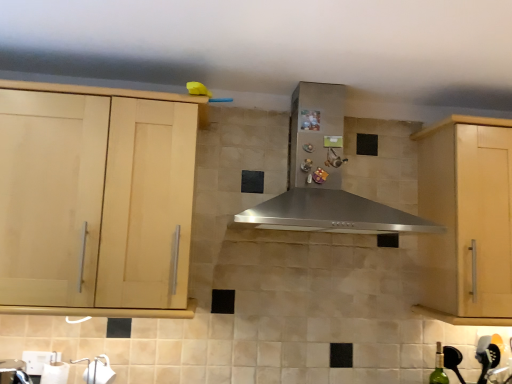
At what (x,y) coordinates should I click in order to perform the action: click on light wood cabinet at right, placed as the first cabinetry when sorted from right to left. Please return your answer as a coordinate pair (x, y). Looking at the image, I should click on (467, 218).

Measure the distance between point (137, 145) and camera.

They are 4.87 feet apart.

This screenshot has height=384, width=512. Describe the element at coordinates (325, 177) in the screenshot. I see `stainless steel range hood at center` at that location.

Identify the location of light wood cabinet at right, which is counted as the 2th cabinetry, starting from the left. (467, 218).

How much distance is there between stainless steel range hood at center and light wood cabinet at right, which is counted as the 2th cabinetry, starting from the left?

13.90 inches.

Consider the image. Choose the correct answer: Is stainless steel range hood at center inside light wood cabinet at right, placed as the first cabinetry when sorted from right to left, or outside it?

stainless steel range hood at center cannot be found inside light wood cabinet at right, placed as the first cabinetry when sorted from right to left.

The width and height of the screenshot is (512, 384). Identify the location of home appliance in front of the light wood cabinet at right, placed as the first cabinetry when sorted from right to left. (325, 177).

From their relative heights in the image, would you say stainless steel range hood at center is taller or shorter than light wood cabinet at right, which is counted as the 2th cabinetry, starting from the left?

stainless steel range hood at center is shorter than light wood cabinet at right, which is counted as the 2th cabinetry, starting from the left.

Is stainless steel range hood at center at the right side of light wood cabinet at left, which is counted as the 2th cabinetry, starting from the right?

Yes, stainless steel range hood at center is to the right of light wood cabinet at left, which is counted as the 2th cabinetry, starting from the right.

Is stainless steel range hood at center not inside light wood cabinet at left, arranged as the first cabinetry when viewed from the left?

Yes, stainless steel range hood at center is not within light wood cabinet at left, arranged as the first cabinetry when viewed from the left.

Could you tell me if stainless steel range hood at center is turned towards light wood cabinet at left, which is counted as the 2th cabinetry, starting from the right?

No, stainless steel range hood at center is not aimed at light wood cabinet at left, which is counted as the 2th cabinetry, starting from the right.

From the image's perspective, is stainless steel range hood at center above light wood cabinet at left, arranged as the first cabinetry when viewed from the left?

Correct, stainless steel range hood at center appears higher than light wood cabinet at left, arranged as the first cabinetry when viewed from the left, in the image.

From the picture: Can you confirm if green glass bottle at lower right is taller than stainless steel range hood at center?

No.

Is there a large distance between green glass bottle at lower right and stainless steel range hood at center?

No, green glass bottle at lower right is not far away from stainless steel range hood at center.

Where is `bottle below the stainless steel range hood at center (from a real-world perspective)`? Image resolution: width=512 pixels, height=384 pixels. bottle below the stainless steel range hood at center (from a real-world perspective) is located at coordinates (439, 368).

From the image's perspective, who appears lower, green glass bottle at lower right or stainless steel range hood at center?

From the image's view, green glass bottle at lower right is below.

From the image's perspective, is stainless steel range hood at center on top of green glass bottle at lower right?

Correct, stainless steel range hood at center appears higher than green glass bottle at lower right in the image.

Between stainless steel range hood at center and green glass bottle at lower right, which one has larger width?

With larger width is stainless steel range hood at center.

Which of these two, stainless steel range hood at center or green glass bottle at lower right, stands taller?

With more height is stainless steel range hood at center.

Which is in front, point (298, 168) or point (430, 379)?

The point (430, 379) is in front.

Is light wood cabinet at left, arranged as the first cabinetry when viewed from the left, positioned far away from green glass bottle at lower right?

Yes, light wood cabinet at left, arranged as the first cabinetry when viewed from the left, is far from green glass bottle at lower right.

Which of these two, light wood cabinet at left, arranged as the first cabinetry when viewed from the left, or green glass bottle at lower right, is wider?

Wider between the two is light wood cabinet at left, arranged as the first cabinetry when viewed from the left.

Considering the positions of objects light wood cabinet at left, arranged as the first cabinetry when viewed from the left, and green glass bottle at lower right in the image provided, who is more to the right, light wood cabinet at left, arranged as the first cabinetry when viewed from the left, or green glass bottle at lower right?

green glass bottle at lower right.

How far apart are light wood cabinet at left, arranged as the first cabinetry when viewed from the left, and green glass bottle at lower right?

They are 4.91 feet apart.

From the picture: How different are the orientations of light wood cabinet at right, which is counted as the 2th cabinetry, starting from the left, and stainless steel range hood at center in degrees?

The angular difference between light wood cabinet at right, which is counted as the 2th cabinetry, starting from the left, and stainless steel range hood at center is 0.108 degrees.

Considering the relative sizes of light wood cabinet at right, which is counted as the 2th cabinetry, starting from the left, and stainless steel range hood at center in the image provided, is light wood cabinet at right, which is counted as the 2th cabinetry, starting from the left, thinner than stainless steel range hood at center?

Yes, light wood cabinet at right, which is counted as the 2th cabinetry, starting from the left, is thinner than stainless steel range hood at center.

From a real-world perspective, is light wood cabinet at right, placed as the first cabinetry when sorted from right to left, beneath stainless steel range hood at center?

Yes, from a real-world perspective, light wood cabinet at right, placed as the first cabinetry when sorted from right to left, is under stainless steel range hood at center.

Considering the relative sizes of light wood cabinet at right, which is counted as the 2th cabinetry, starting from the left, and stainless steel range hood at center in the image provided, is light wood cabinet at right, which is counted as the 2th cabinetry, starting from the left, shorter than stainless steel range hood at center?

In fact, light wood cabinet at right, which is counted as the 2th cabinetry, starting from the left, may be taller than stainless steel range hood at center.

From a real-world perspective, is light wood cabinet at right, which is counted as the 2th cabinetry, starting from the left, positioned under light wood cabinet at left, arranged as the first cabinetry when viewed from the left, based on gravity?

Incorrect, from a real-world perspective, light wood cabinet at right, which is counted as the 2th cabinetry, starting from the left, is higher than light wood cabinet at left, arranged as the first cabinetry when viewed from the left.

Considering the sizes of objects light wood cabinet at right, placed as the first cabinetry when sorted from right to left, and light wood cabinet at left, which is counted as the 2th cabinetry, starting from the right, in the image provided, who is taller, light wood cabinet at right, placed as the first cabinetry when sorted from right to left, or light wood cabinet at left, which is counted as the 2th cabinetry, starting from the right,?

light wood cabinet at right, placed as the first cabinetry when sorted from right to left, is taller.

Are light wood cabinet at right, placed as the first cabinetry when sorted from right to left, and light wood cabinet at left, arranged as the first cabinetry when viewed from the left, beside each other?

There is a gap between light wood cabinet at right, placed as the first cabinetry when sorted from right to left, and light wood cabinet at left, arranged as the first cabinetry when viewed from the left.

Is light wood cabinet at right, placed as the first cabinetry when sorted from right to left, inside the boundaries of light wood cabinet at left, which is counted as the 2th cabinetry, starting from the right, or outside?

light wood cabinet at right, placed as the first cabinetry when sorted from right to left, is not inside light wood cabinet at left, which is counted as the 2th cabinetry, starting from the right, it's outside.

This screenshot has width=512, height=384. What are the coordinates of `the 2nd cabinetry below the stainless steel range hood at center (from the image's perspective)` in the screenshot? It's located at (467, 218).

The image size is (512, 384). I want to click on home appliance that appears in front of the light wood cabinet at left, which is counted as the 2th cabinetry, starting from the right, so click(x=325, y=177).

Considering their positions, is light wood cabinet at right, placed as the first cabinetry when sorted from right to left, positioned further to light wood cabinet at left, arranged as the first cabinetry when viewed from the left, than stainless steel range hood at center?

light wood cabinet at right, placed as the first cabinetry when sorted from right to left.

When comparing their distances from green glass bottle at lower right, does stainless steel range hood at center or light wood cabinet at right, which is counted as the 2th cabinetry, starting from the left, seem further?

stainless steel range hood at center is positioned further to the anchor green glass bottle at lower right.

Looking at the image, which one is located closer to stainless steel range hood at center, light wood cabinet at left, arranged as the first cabinetry when viewed from the left, or light wood cabinet at right, which is counted as the 2th cabinetry, starting from the left?

The object closer to stainless steel range hood at center is light wood cabinet at right, which is counted as the 2th cabinetry, starting from the left.

Based on their spatial positions, is green glass bottle at lower right or stainless steel range hood at center further from light wood cabinet at left, which is counted as the 2th cabinetry, starting from the right?

green glass bottle at lower right.

From the image, which object appears to be nearer to green glass bottle at lower right, light wood cabinet at left, arranged as the first cabinetry when viewed from the left, or light wood cabinet at right, placed as the first cabinetry when sorted from right to left?

Based on the image, light wood cabinet at right, placed as the first cabinetry when sorted from right to left, appears to be nearer to green glass bottle at lower right.

Based on their spatial positions, is stainless steel range hood at center or light wood cabinet at left, which is counted as the 2th cabinetry, starting from the right, further from green glass bottle at lower right?

The object further to green glass bottle at lower right is light wood cabinet at left, which is counted as the 2th cabinetry, starting from the right.

Considering their positions, is light wood cabinet at right, placed as the first cabinetry when sorted from right to left, positioned closer to green glass bottle at lower right than stainless steel range hood at center?

Among the two, light wood cabinet at right, placed as the first cabinetry when sorted from right to left, is located nearer to green glass bottle at lower right.

Estimate the real-world distances between objects in this image. Which object is further from light wood cabinet at left, which is counted as the 2th cabinetry, starting from the right, stainless steel range hood at center or green glass bottle at lower right?

The object further to light wood cabinet at left, which is counted as the 2th cabinetry, starting from the right, is green glass bottle at lower right.

Where is `home appliance located between light wood cabinet at left, arranged as the first cabinetry when viewed from the left, and green glass bottle at lower right in the left-right direction`? home appliance located between light wood cabinet at left, arranged as the first cabinetry when viewed from the left, and green glass bottle at lower right in the left-right direction is located at coordinates (325, 177).

This screenshot has width=512, height=384. Find the location of `home appliance located between light wood cabinet at left, which is counted as the 2th cabinetry, starting from the right, and light wood cabinet at right, placed as the first cabinetry when sorted from right to left, in the left-right direction`. home appliance located between light wood cabinet at left, which is counted as the 2th cabinetry, starting from the right, and light wood cabinet at right, placed as the first cabinetry when sorted from right to left, in the left-right direction is located at coordinates (325, 177).

The image size is (512, 384). What are the coordinates of `bottle located between light wood cabinet at left, which is counted as the 2th cabinetry, starting from the right, and light wood cabinet at right, placed as the first cabinetry when sorted from right to left, in the left-right direction` in the screenshot? It's located at coord(439,368).